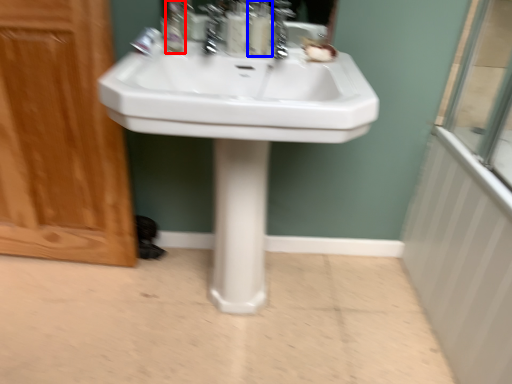
Question: Which of the following is the farthest to the observer, mouthwash (highlighted by a red box) or soap dispenser (highlighted by a blue box)?

Choices:
 (A) mouthwash
 (B) soap dispenser

Answer: (B)